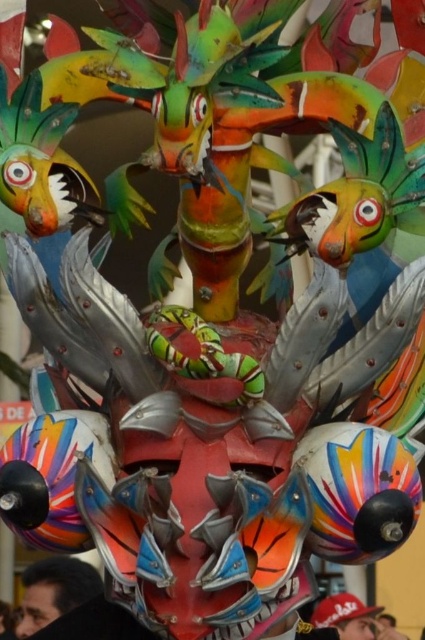
You are an artist trying to sketch the decorative piece. You notice two points on the image at coordinates point (x=88, y=596) and point (x=379, y=611). Which point should you focus on first if you want to draw the part closest to the viewer?

Point (x=88, y=596) is in front of point (x=379, y=611), so you should focus on point (x=88, y=596) first as it is closer to the viewer.

You are an artist planning to paint a miniature version of this decorative piece. You need to ensure the proportions between the matte black head at lower left and the matte red baseball cap at lower center are accurate. Which object should you paint first to maintain scale, and why?

You should paint the matte black head at lower left first because it is larger than the matte red baseball cap at lower center. By starting with the bigger object, you can establish the scale and ensure the smaller object fits proportionally.

You are an artist trying to sketch the scene. You notice the matte black head at lower left and the matte red baseball cap at lower center. Which object should you draw first if you want to start with the taller one?

The matte black head at lower left is much taller than the matte red baseball cap at lower center, so you should draw the matte black head at lower left first.